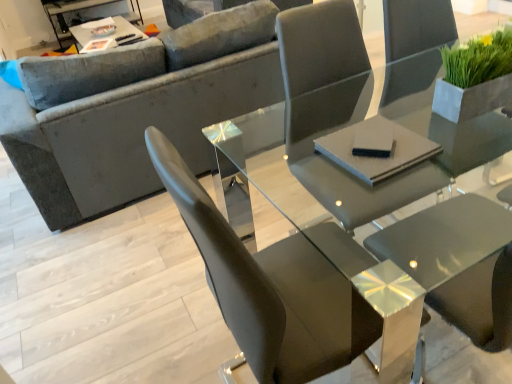
Question: Is velvet gray couch at upper left not inside matte gray chair at center?

Choices:
 (A) no
 (B) yes

Answer: (B)

Question: Is velvet gray couch at upper left at the right side of matte gray chair at center?

Choices:
 (A) yes
 (B) no

Answer: (B)

Question: Is velvet gray couch at upper left bigger than matte gray chair at center?

Choices:
 (A) no
 (B) yes

Answer: (B)

Question: Is velvet gray couch at upper left not close to matte gray chair at center?

Choices:
 (A) yes
 (B) no

Answer: (B)

Question: Is velvet gray couch at upper left in front of matte gray chair at center?

Choices:
 (A) yes
 (B) no

Answer: (B)

Question: From the image's perspective, is velvet gray couch at upper left located above matte gray chair at center?

Choices:
 (A) no
 (B) yes

Answer: (B)

Question: Can you confirm if black matte pad at center, positioned as the 1th pad in left-to-right order, is smaller than gray matte pad at center, the second pad from the left?

Choices:
 (A) yes
 (B) no

Answer: (A)

Question: Could you tell me if black matte pad at center, positioned as the 1th pad in left-to-right order, is facing gray matte pad at center, the first pad when ordered from right to left?

Choices:
 (A) no
 (B) yes

Answer: (B)

Question: Is black matte pad at center, positioned as the 2th pad in right-to-left order, shorter than gray matte pad at center, the second pad from the left?

Choices:
 (A) yes
 (B) no

Answer: (B)

Question: Is black matte pad at center, positioned as the 2th pad in right-to-left order, completely or partially outside of gray matte pad at center, the second pad from the left?

Choices:
 (A) yes
 (B) no

Answer: (B)

Question: Considering the relative positions of black matte pad at center, positioned as the 2th pad in right-to-left order, and gray matte pad at center, the second pad from the left, in the image provided, is black matte pad at center, positioned as the 2th pad in right-to-left order, behind gray matte pad at center, the second pad from the left,?

Choices:
 (A) yes
 (B) no

Answer: (A)

Question: Does black matte pad at center, positioned as the 1th pad in left-to-right order, have a greater height compared to gray matte pad at center, the second pad from the left?

Choices:
 (A) yes
 (B) no

Answer: (A)

Question: Does velvet gray couch at upper left have a lesser width compared to green matte plant at upper right?

Choices:
 (A) yes
 (B) no

Answer: (B)